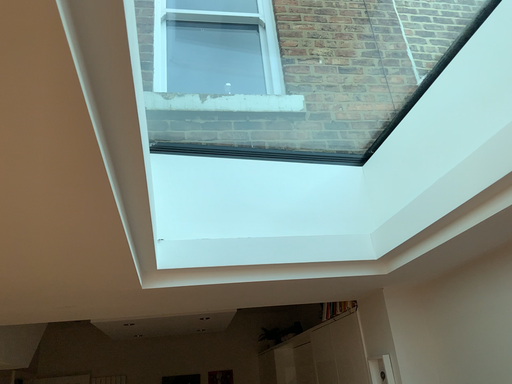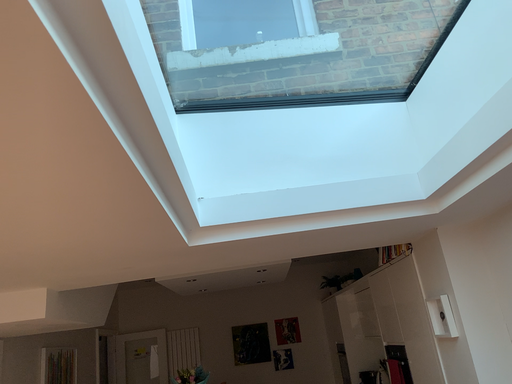
Question: How did the camera likely rotate when shooting the video?

Choices:
 (A) rotated right
 (B) rotated left

Answer: (B)